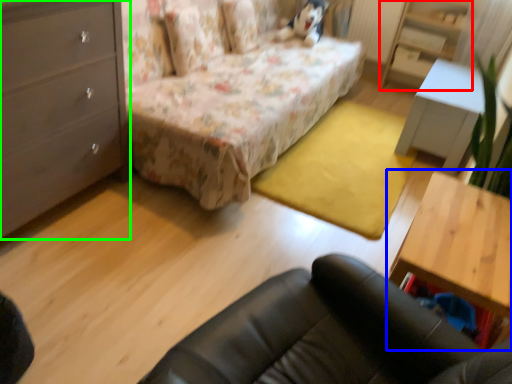
Question: Which object is positioned closest to dresser (highlighted by a red box)? Select from table (highlighted by a blue box) and chest of drawers (highlighted by a green box).

Choices:
 (A) table
 (B) chest of drawers

Answer: (A)